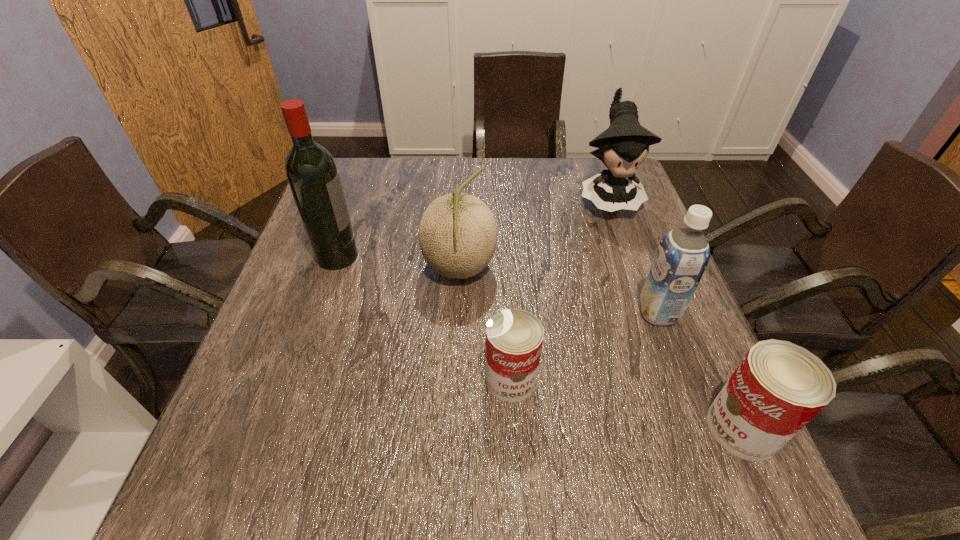
Locate an element on the screen. This screenshot has height=540, width=960. the shorter can is located at coordinates (514, 337).

Identify the location of the shortest object. This screenshot has width=960, height=540. (514, 337).

Find the location of a particular element. This screenshot has width=960, height=540. the fifth tallest object is located at coordinates (778, 387).

Where is `the taller can`? The width and height of the screenshot is (960, 540). the taller can is located at coordinates (778, 387).

Identify the location of doll. The height and width of the screenshot is (540, 960). (624, 146).

At what (x,y) coordinates should I click in order to perform the action: click on cantaloup. Please return your answer as a coordinate pair (x, y). The image size is (960, 540). Looking at the image, I should click on (458, 234).

Find the location of a particular element. The height and width of the screenshot is (540, 960). the tallest object is located at coordinates (311, 171).

The image size is (960, 540). I want to click on wine bottle, so click(x=311, y=171).

Locate an element on the screen. This screenshot has width=960, height=540. soya milk is located at coordinates (682, 256).

Where is `free space located on the front label of the shorter can`? free space located on the front label of the shorter can is located at coordinates (514, 428).